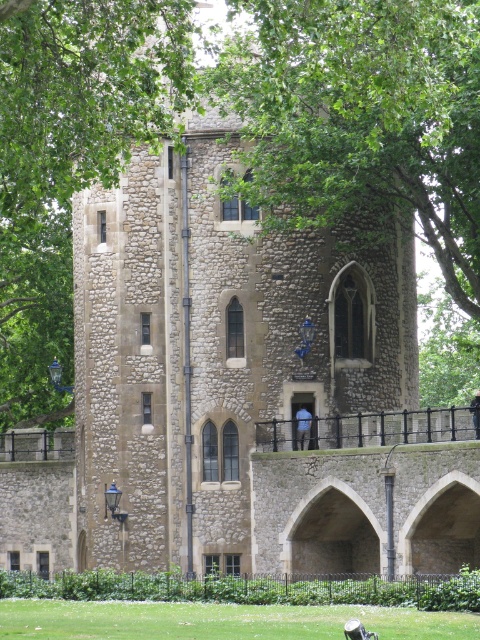
Is green leafy tree at upper center to the left of green grass at lower center from the viewer's perspective?

Indeed, green leafy tree at upper center is positioned on the left side of green grass at lower center.

Which is behind, point (80, 173) or point (147, 618)?

The point (147, 618) is behind.

Where is `green leafy tree at upper center`? The width and height of the screenshot is (480, 640). green leafy tree at upper center is located at coordinates (70, 157).